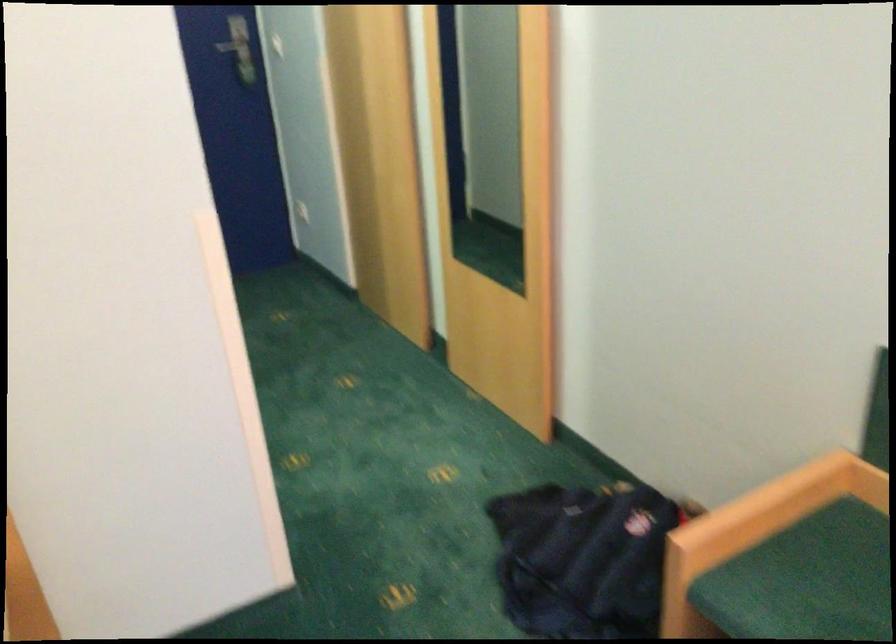
The width and height of the screenshot is (896, 644). Describe the element at coordinates (806, 580) in the screenshot. I see `the chair sitting surface` at that location.